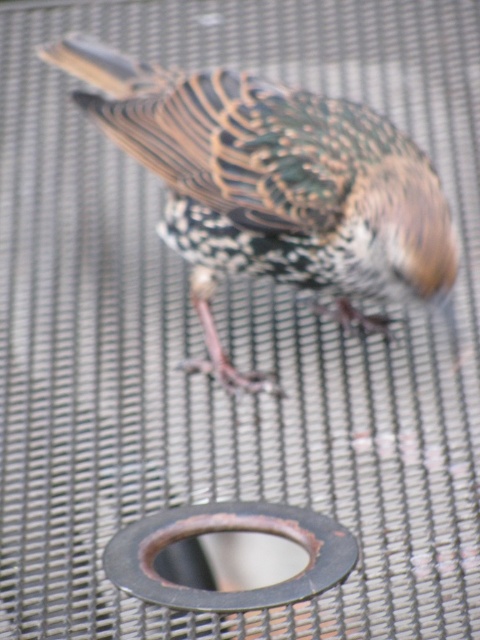
You are a birdwatcher trying to capture a photo of the speckled feathered bird at center and the rusty metal drain at center in the same frame. Given that your camera has a focal length of 50mm, can you estimate if they are within the camera field of view? Assume the field of view for a 50mm lens on your camera is approximately 46 degrees horizontally.

The speckled feathered bird at center and rusty metal drain at center are 20.40 inches apart. To determine if they fit within the 46 degree field of view, you would need to know the distance from the camera to the subjects. Without this distance, the angular field of view cannot be accurately calculated to confirm if the 20.40 inches separation falls within the 46 degrees.

You are a photographer trying to capture a closeup of the speckled feathered bird at center and the rusty metal drain at center. Which object should you focus on first if you want to ensure both are in focus without changing your camera settings?

The speckled feathered bird at center is much taller than the rusty metal drain at center, so focusing on the bird first would allow the drain to fall within the depth of field since it is closer to the camera.